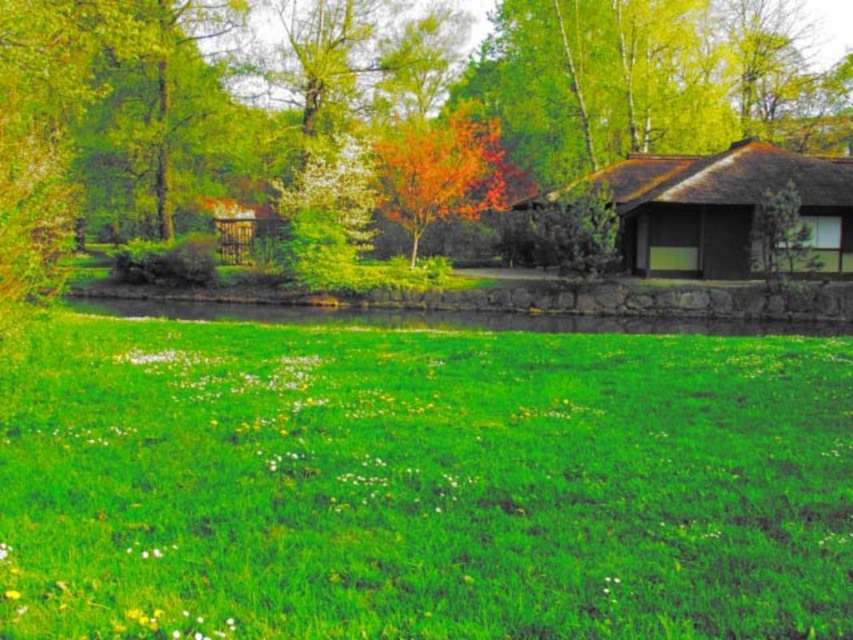
Between green grass at center and brown thatched hut at upper right, which one has more height?

Standing taller between the two is brown thatched hut at upper right.

Can you confirm if green grass at center is positioned to the right of brown thatched hut at upper right?

Incorrect, green grass at center is not on the right side of brown thatched hut at upper right.

Locate an element on the screen. green grass at center is located at coordinates coord(424,484).

Who is positioned more to the right, brown thatched hut at upper right or autumn leaves tree at center?

brown thatched hut at upper right is more to the right.

Can you confirm if brown thatched hut at upper right is positioned above autumn leaves tree at center?

No, brown thatched hut at upper right is not above autumn leaves tree at center.

This screenshot has width=853, height=640. What are the coordinates of `brown thatched hut at upper right` in the screenshot? It's located at click(723, 209).

Can you confirm if green grass at center is positioned to the left of autumn leaves tree at center?

Yes, green grass at center is to the left of autumn leaves tree at center.

Does point (405, 577) lie behind point (480, 118)?

No, (405, 577) is in front of (480, 118).

Is point (674, 356) positioned after point (485, 209)?

No.

Locate an element on the screen. Image resolution: width=853 pixels, height=640 pixels. green grass at center is located at coordinates click(424, 484).